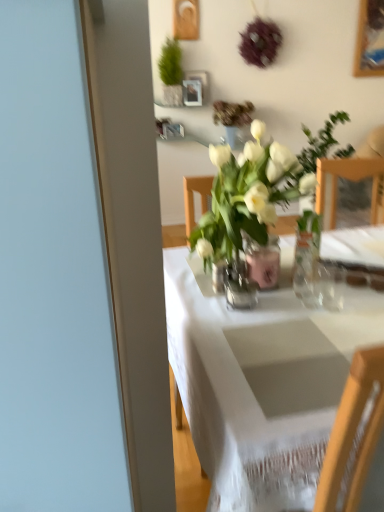
The image size is (384, 512). Identify the location of vacant space situated on the left part of clear glass vase at center, the 2th vase viewed from the back. (198, 301).